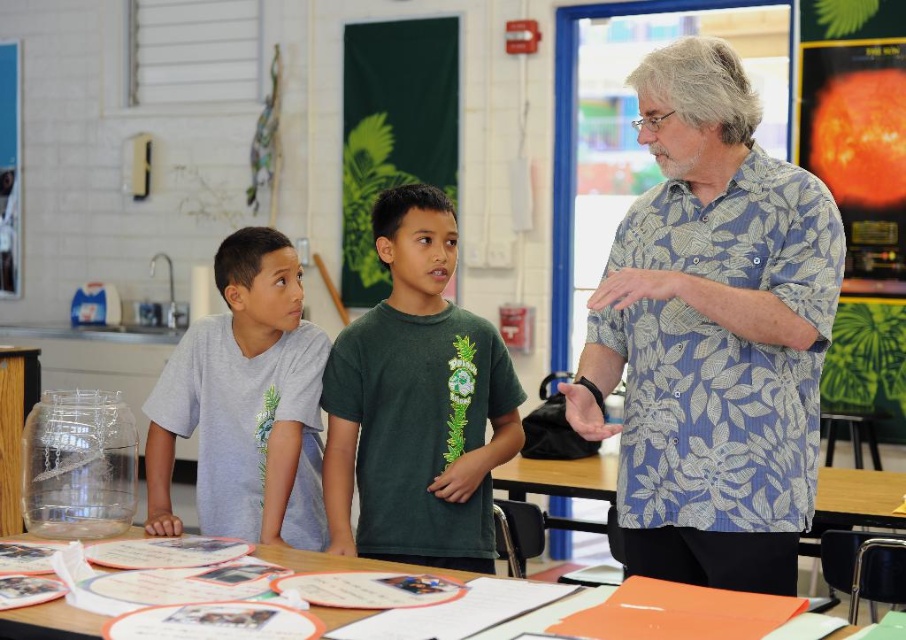
Question: Which object is closer to the camera taking this photo?

Choices:
 (A) blue floral shirt at center
 (B) gray matte shirt at center
 (C) orange paper at center
 (D) orange paper at lower center

Answer: (D)

Question: Which point is farther to the camera?

Choices:
 (A) green matte shirt at center
 (B) orange paper at lower center
 (C) gray matte shirt at center
 (D) orange paper at center

Answer: (D)

Question: Which point appears closest to the camera in this image?

Choices:
 (A) (370, 570)
 (B) (764, 349)

Answer: (A)

Question: Is green matte shirt at center to the left of orange paper at center from the viewer's perspective?

Choices:
 (A) no
 (B) yes

Answer: (B)

Question: Does orange paper at center have a larger size compared to orange paper at lower center?

Choices:
 (A) no
 (B) yes

Answer: (B)

Question: Is green matte shirt at center positioned behind orange paper at lower center?

Choices:
 (A) no
 (B) yes

Answer: (B)